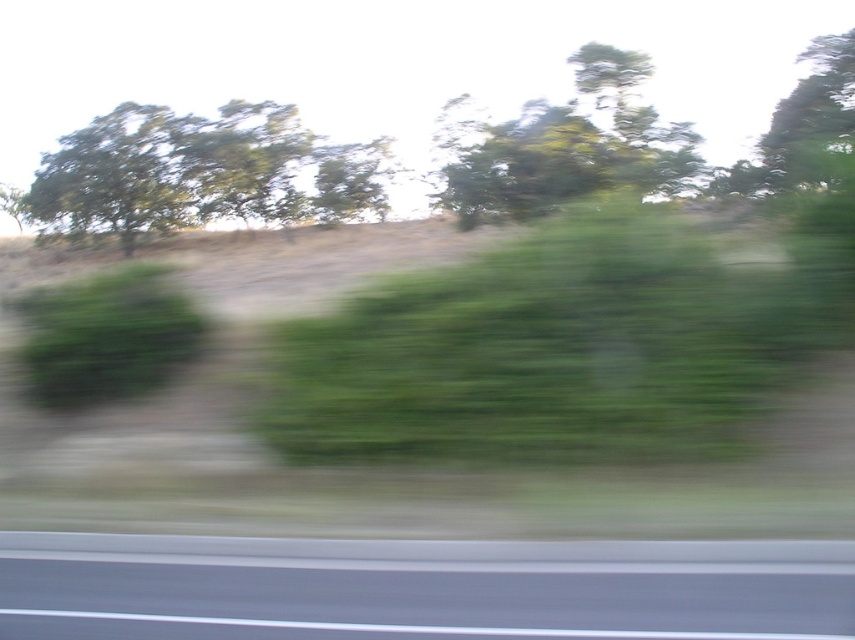
Question: In this image, where is green leafy tree at upper left located relative to green leafy tree at upper center?

Choices:
 (A) right
 (B) left

Answer: (B)

Question: Is smooth asphalt highway at lower center smaller than green leafy tree at upper center?

Choices:
 (A) no
 (B) yes

Answer: (B)

Question: Which point is closer to the camera?

Choices:
 (A) (28, 556)
 (B) (484, 378)
 (C) (744, 186)
 (D) (575, 84)

Answer: (A)

Question: Which object is closer to the camera taking this photo?

Choices:
 (A) smooth asphalt highway at lower center
 (B) green leafy tree at upper center
 (C) green leafy hedge at center

Answer: (A)

Question: Is green leafy tree at upper left bigger than green leafy tree at upper right?

Choices:
 (A) yes
 (B) no

Answer: (A)

Question: Which object is the closest to the smooth asphalt highway at lower center?

Choices:
 (A) green leafy tree at upper center
 (B) green leafy tree at upper right
 (C) green leafy hedge at center
 (D) green leafy bush at left

Answer: (C)